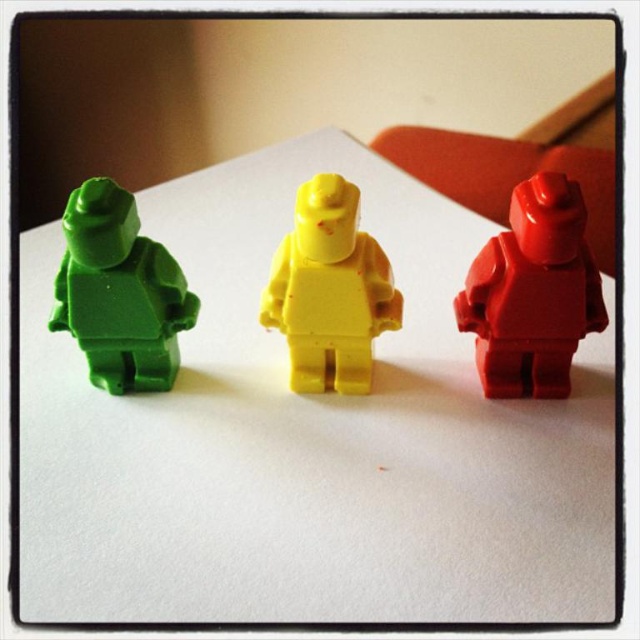
Is white paper at center to the right of matte green plastic figure at left from the viewer's perspective?

Correct, you'll find white paper at center to the right of matte green plastic figure at left.

Consider the image. Who is positioned more to the left, white paper at center or matte green plastic figure at left?

matte green plastic figure at left is more to the left.

Which is in front, point (92, 436) or point (134, 390)?

Point (92, 436) is more forward.

In order to click on white paper at center in this screenshot , I will do `click(308, 436)`.

Between white paper at center and matte red figure at right, which one has less height?

matte red figure at right

Who is positioned more to the right, white paper at center or matte red figure at right?

Positioned to the right is matte red figure at right.

Between point (273, 204) and point (540, 237), which one is positioned behind?

Positioned behind is point (273, 204).

Where is `white paper at center`? The height and width of the screenshot is (640, 640). white paper at center is located at coordinates (308, 436).

Can you confirm if matte red figure at right is smaller than yellow matte plastic minifigure at center?

Incorrect, matte red figure at right is not smaller in size than yellow matte plastic minifigure at center.

Is matte red figure at right shorter than yellow matte plastic minifigure at center?

No.

Locate an element on the screen. The width and height of the screenshot is (640, 640). matte red figure at right is located at coordinates (532, 292).

Locate an element on the screen. matte red figure at right is located at coordinates (532, 292).